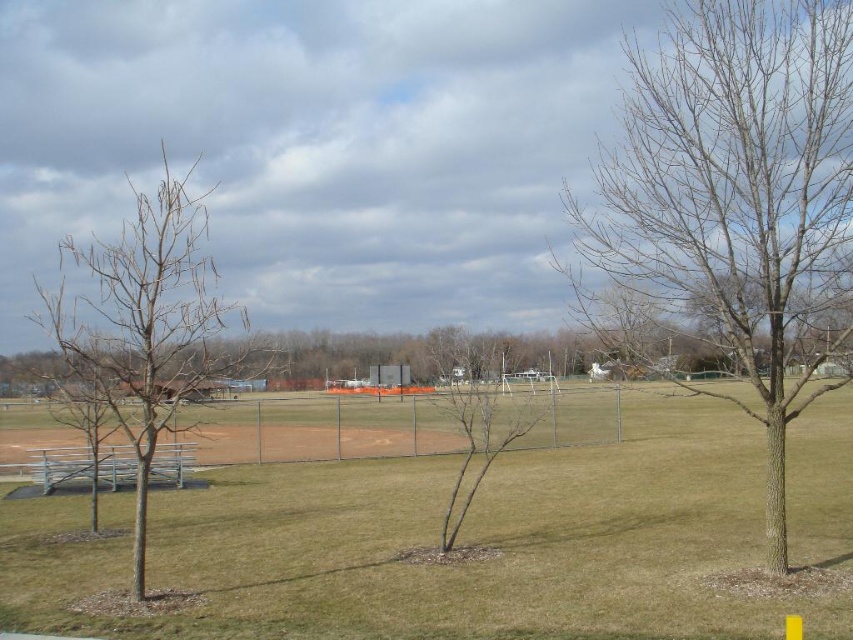
Question: In this image, where is bare wood tree at left located relative to bare wood tree at center?

Choices:
 (A) above
 (B) below

Answer: (A)

Question: Does bare wood tree at right lie behind bare wood tree at left?

Choices:
 (A) yes
 (B) no

Answer: (B)

Question: Estimate the real-world distances between objects in this image. Which object is closer to the green grass at center?

Choices:
 (A) bare wood tree at right
 (B) bare wood tree at left
 (C) bare wood tree at center

Answer: (C)

Question: Does bare wood tree at right have a smaller size compared to bare wood tree at left?

Choices:
 (A) yes
 (B) no

Answer: (A)

Question: Which of these objects is positioned farthest from the bare wood tree at right?

Choices:
 (A) bare wood tree at left
 (B) green grass at center
 (C) bare wood tree at center

Answer: (A)

Question: Based on their relative distances, which object is nearer to the green grass at center?

Choices:
 (A) bare wood tree at right
 (B) bare wood tree at left
 (C) bare wood tree at center

Answer: (C)